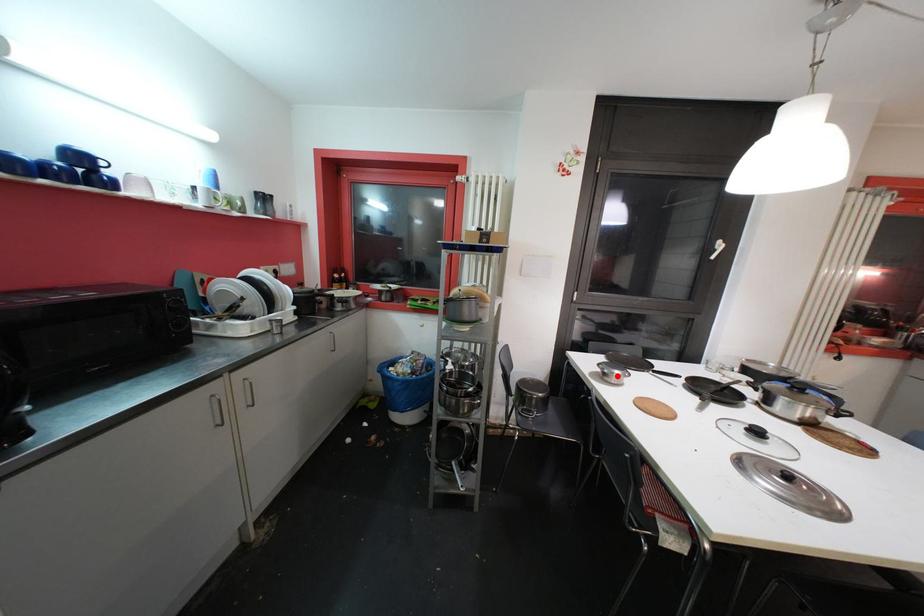
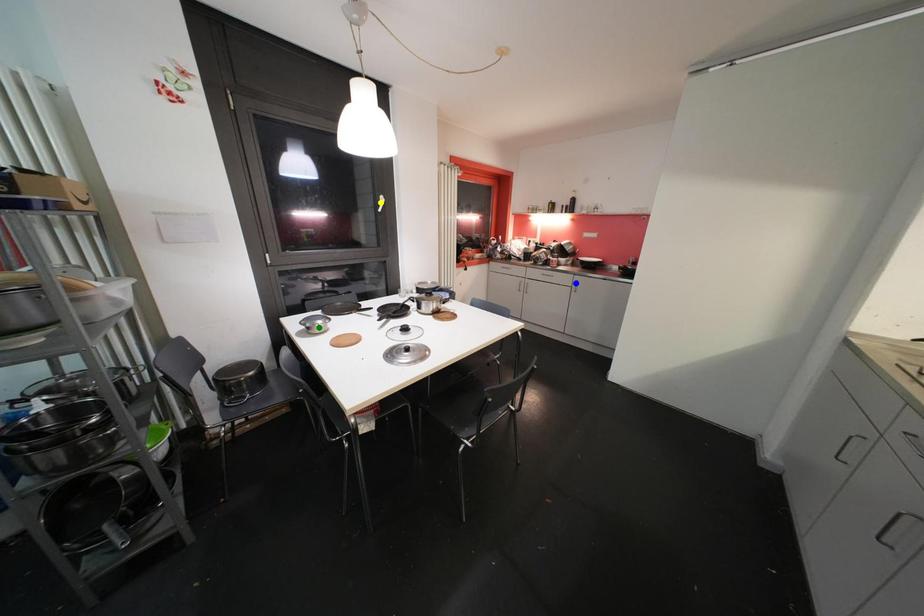
Question: I am providing you with two images of the same scene from different viewpoints. A red point is marked on the first image. You are given multiple points on the second image. Which point in image 2 represents the same 3d spot as the red point in image 1?

Choices:
 (A) yellow point
 (B) green point
 (C) blue point

Answer: (B)